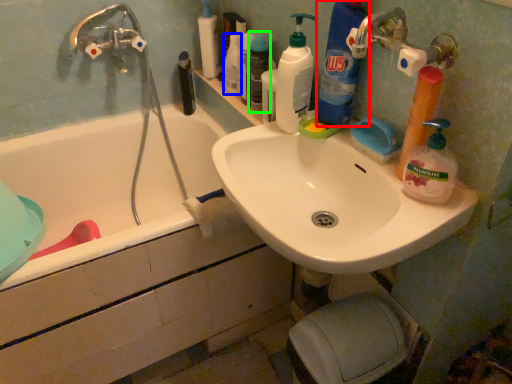
Question: Which is nearer to the cleaning product (highlighted by a red box)? toiletry (highlighted by a blue box) or toiletry (highlighted by a green box).

Choices:
 (A) toiletry
 (B) toiletry

Answer: (B)